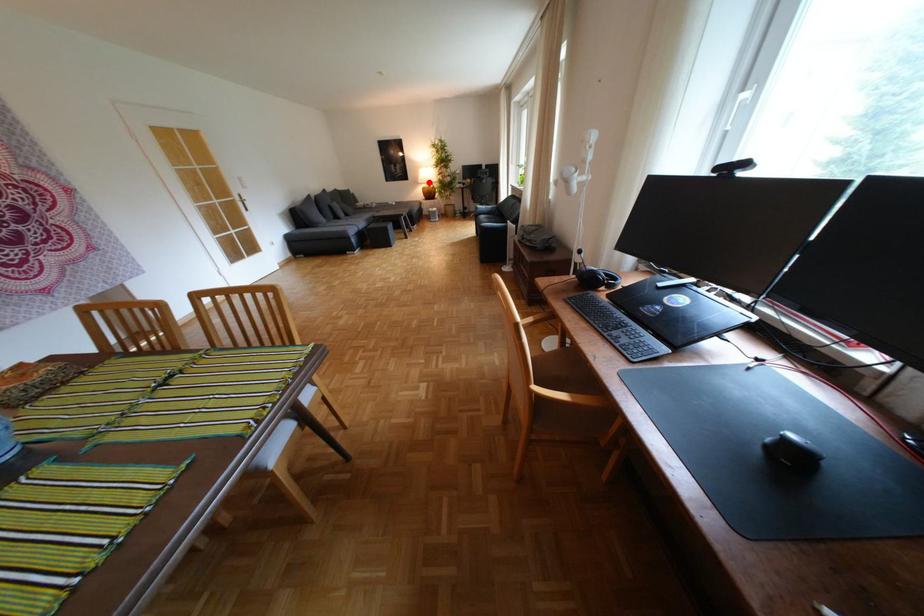
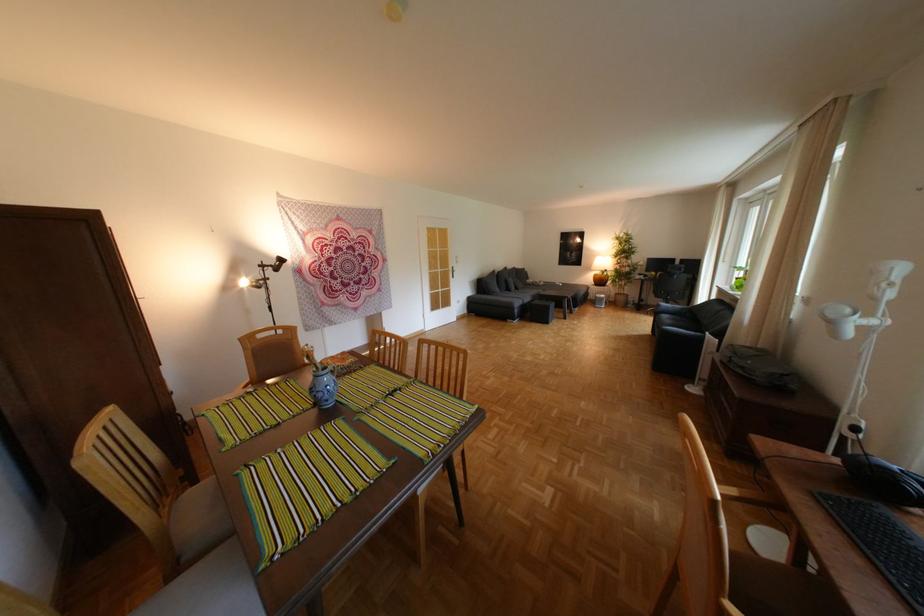
Find the pixel in the second image that matches the highlighted location in the first image.

(602, 268)